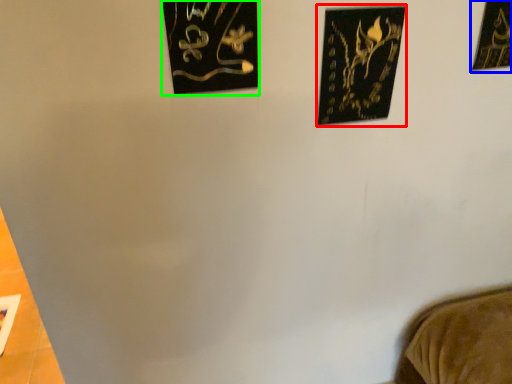
Question: Based on their relative distances, which object is nearer to picture frame (highlighted by a red box)? Choose from picture frame (highlighted by a blue box) and picture frame (highlighted by a green box).

Choices:
 (A) picture frame
 (B) picture frame

Answer: (B)